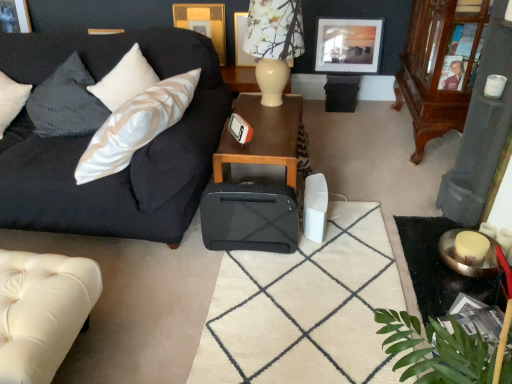
Question: Should I look upward or downward to see mahogany wood dresser at right?

Choices:
 (A) down
 (B) up

Answer: (B)

Question: From a real-world perspective, is wooden picture frame at upper left, acting as the 4th picture frame starting from the right, positioned under mahogany wood dresser at right based on gravity?

Choices:
 (A) no
 (B) yes

Answer: (A)

Question: Can you see wooden picture frame at upper left, placed as the 1th picture frame when sorted from left to right, touching mahogany wood dresser at right?

Choices:
 (A) yes
 (B) no

Answer: (B)

Question: Is wooden picture frame at upper left, placed as the 1th picture frame when sorted from left to right, to the left of mahogany wood dresser at right from the viewer's perspective?

Choices:
 (A) no
 (B) yes

Answer: (B)

Question: Is wooden picture frame at upper left, placed as the 1th picture frame when sorted from left to right, thinner than mahogany wood dresser at right?

Choices:
 (A) no
 (B) yes

Answer: (B)

Question: Is wooden picture frame at upper left, acting as the 4th picture frame starting from the right, to the right of mahogany wood dresser at right from the viewer's perspective?

Choices:
 (A) no
 (B) yes

Answer: (A)

Question: Is wooden picture frame at upper left, acting as the 4th picture frame starting from the right, looking in the opposite direction of mahogany wood dresser at right?

Choices:
 (A) yes
 (B) no

Answer: (B)

Question: Does green leafy plant at lower right have a greater width compared to wooden picture frame at upper center, which is the 3th picture frame in right-to-left order?

Choices:
 (A) yes
 (B) no

Answer: (A)

Question: Is green leafy plant at lower right shorter than wooden picture frame at upper center, the second picture frame when ordered from left to right?

Choices:
 (A) no
 (B) yes

Answer: (B)

Question: Does green leafy plant at lower right turn towards wooden picture frame at upper center, which is the 3th picture frame in right-to-left order?

Choices:
 (A) yes
 (B) no

Answer: (B)

Question: Is green leafy plant at lower right bigger than wooden picture frame at upper center, which is the 3th picture frame in right-to-left order?

Choices:
 (A) no
 (B) yes

Answer: (A)

Question: Considering the relative sizes of green leafy plant at lower right and wooden picture frame at upper center, which is the 3th picture frame in right-to-left order, in the image provided, is green leafy plant at lower right thinner than wooden picture frame at upper center, which is the 3th picture frame in right-to-left order,?

Choices:
 (A) no
 (B) yes

Answer: (A)

Question: From the image's perspective, is green leafy plant at lower right under wooden picture frame at upper center, which is the 3th picture frame in right-to-left order?

Choices:
 (A) no
 (B) yes

Answer: (B)

Question: Does satin black couch at left, the 2th studio couch positioned from the bottom, have a greater height compared to black fabric suitcase at center?

Choices:
 (A) no
 (B) yes

Answer: (B)